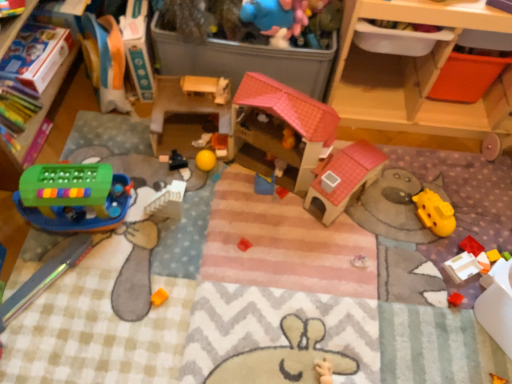
The image size is (512, 384). Identify the location of vacant region in front of bright red plastic block at lower right, which appears as the first toy when viewed from the right. (456, 302).